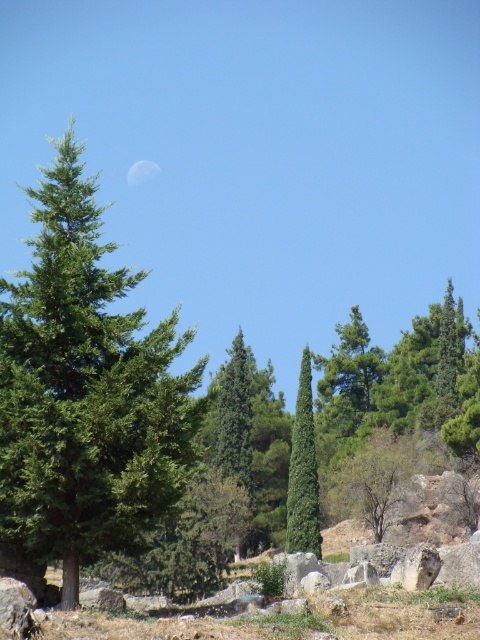
Does green needle-like at center appear on the right side of green matte tree at center?

Answer: Incorrect, green needle-like at center is not on the right side of green matte tree at center.

Find the location of `green needle-like at center`. green needle-like at center is located at coordinates (85, 388).

Does point (81, 275) come closer to viewer compared to point (288, 518)?

That is True.

This screenshot has width=480, height=640. What are the coordinates of `green needle-like at center` in the screenshot? It's located at (85, 388).